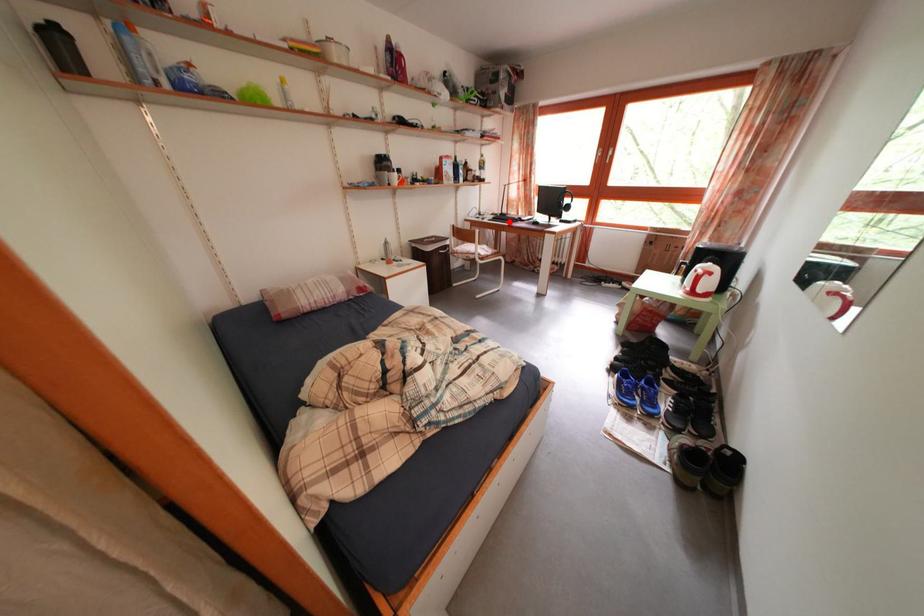
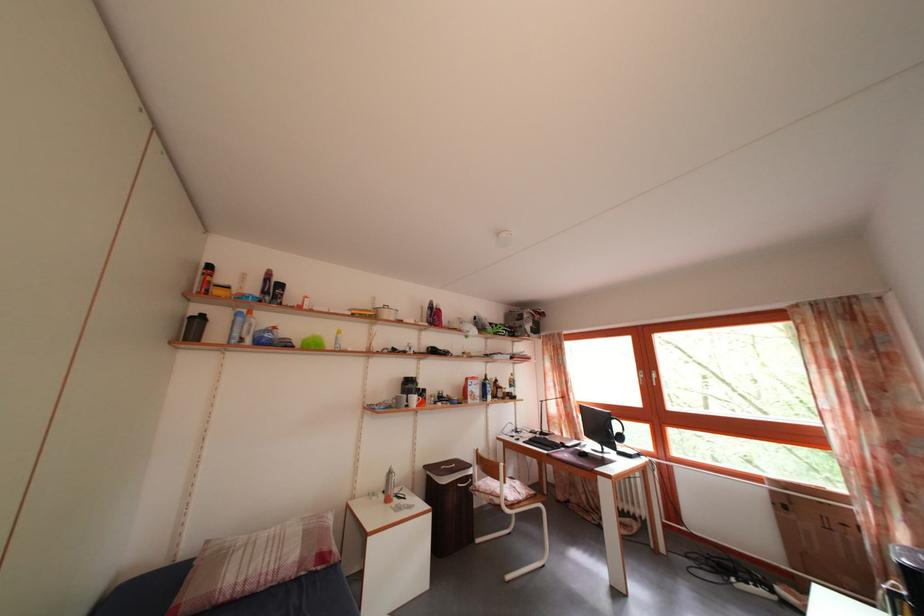
The point at the highlighted location is marked in the first image. Where is the corresponding point in the second image?

(550, 440)